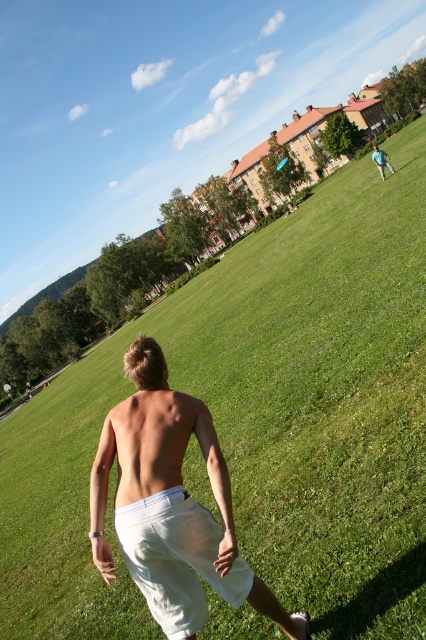
This screenshot has height=640, width=426. What do you see at coordinates (170, 506) in the screenshot?
I see `white cotton shorts at center` at bounding box center [170, 506].

Who is taller, white cotton shorts at center or white cotton shorts at lower center?

white cotton shorts at center is taller.

You are a GUI agent. You are given a task and a screenshot of the screen. Output one action in this format:
    pyautogui.click(x=<x>, y=<y>)
    Task: Click on the white cotton shorts at center
    
    Given the screenshot: What is the action you would take?
    pyautogui.click(x=170, y=506)

This screenshot has width=426, height=640. What do you see at coordinates (170, 506) in the screenshot? I see `white cotton shorts at center` at bounding box center [170, 506].

Can you confirm if white cotton shorts at center is bigger than skinny white shorts at center?

Yes, white cotton shorts at center is bigger than skinny white shorts at center.

Locate an element on the screen. The width and height of the screenshot is (426, 640). white cotton shorts at center is located at coordinates (170, 506).

Does white cotton shorts at lower center have a smaller size compared to green fabric shirt at upper right?

Yes, white cotton shorts at lower center is smaller than green fabric shirt at upper right.

Who is more distant from viewer, (157,572) or (385,154)?

The point (385,154) is more distant.

The height and width of the screenshot is (640, 426). Find the location of `white cotton shorts at lower center`. white cotton shorts at lower center is located at coordinates (176, 557).